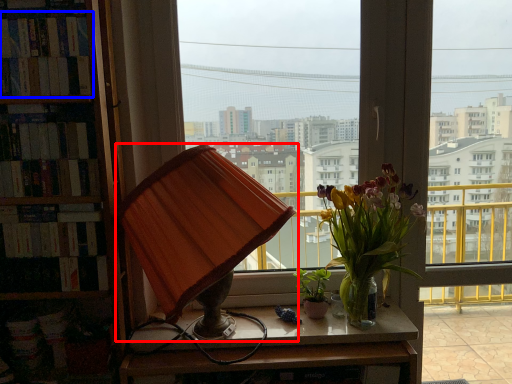
Question: Which object appears closest to the camera in this image, lamp (highlighted by a red box) or book (highlighted by a blue box)?

Choices:
 (A) lamp
 (B) book

Answer: (A)